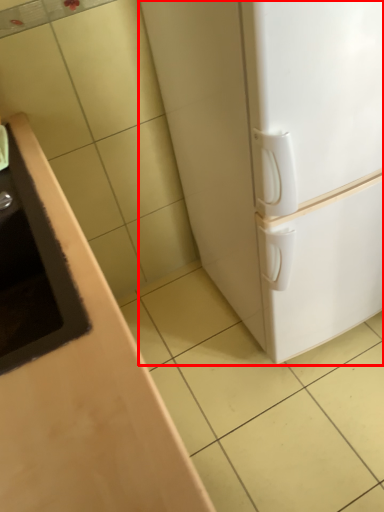
Question: Considering the relative positions of refrigerator (annotated by the red box) and sink in the image provided, where is refrigerator (annotated by the red box) located with respect to the staircase?

Choices:
 (A) right
 (B) left

Answer: (A)